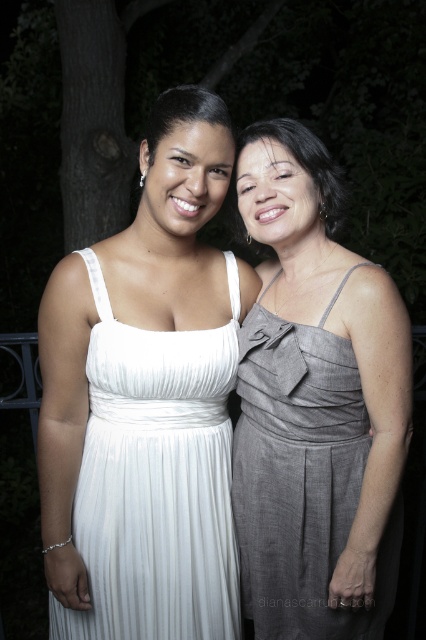
Which is below, white pleated dress at left or gray textured dress at center?

Positioned lower is gray textured dress at center.

Between white pleated dress at left and gray textured dress at center, which one has less height?

Standing shorter between the two is gray textured dress at center.

Does point (187, 396) come behind point (298, 573)?

No, it is not.

The width and height of the screenshot is (426, 640). In order to click on white pleated dress at left in this screenshot , I will do `click(155, 481)`.